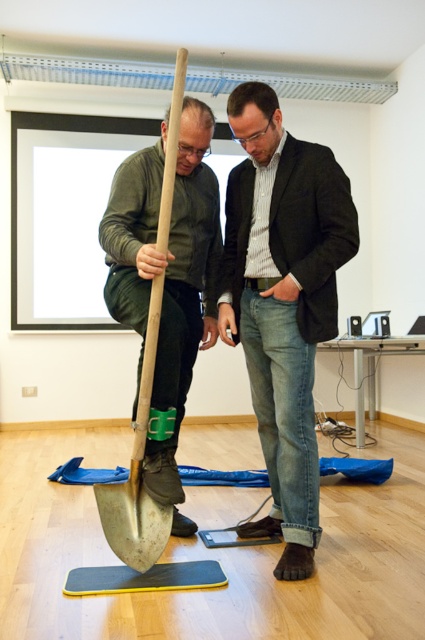
You are organizing a safety inspection in the conference room. You need to ensure that the wooden shovel at left and the rubberized yellow mat at lower center are positioned safely. Based on their sizes, which object is more likely to tip over if leaned against a wall?

The wooden shovel at left is taller than the rubberized yellow mat at lower center, so it is more likely to tip over if leaned against a wall due to its greater height making it less stable.

You are organizing a storage room and need to place the denim jeans at center and the rubberized yellow mat at lower center on a shelf. The shelf has limited space. Based on the image, which item should you place first to ensure both fit on the shelf?

The denim jeans at center has a larger size compared to the rubberized yellow mat at lower center, so you should place the denim jeans at center first to ensure both items fit on the shelf.

You are organizing a small event in the conference room and need to place a 1.2 meter wide banner between the denim jeans at center and the rubberized yellow mat at lower center. Can the banner fit between them without overlapping either object?

The denim jeans at center is narrower than the rubberized yellow mat at lower center. However, the banner requires 1.2 meters of space between them. Since the objects description only provides their widths, not their distance apart, we cannot determine if the banner will fit based on the given information.